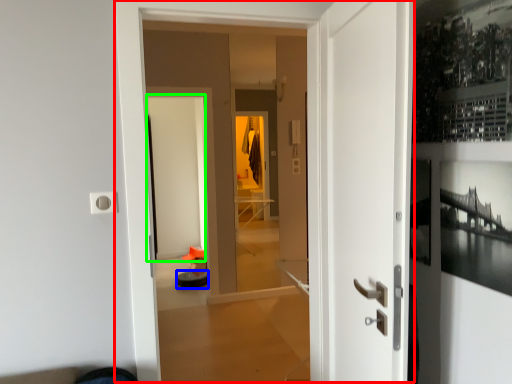
Question: Estimate the real-world distances between objects in this image. Which object is closer to door (highlighted by a red box), furniture (highlighted by a blue box) or screen door (highlighted by a green box)?

Choices:
 (A) furniture
 (B) screen door

Answer: (A)